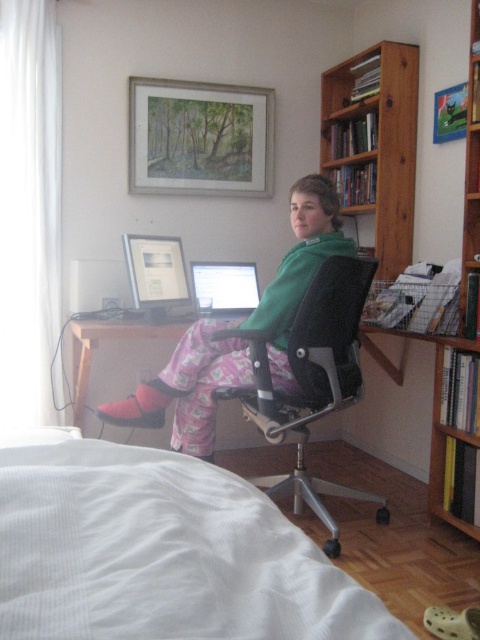
Question: Which point is closer to the camera taking this photo?

Choices:
 (A) (226, 100)
 (B) (404, 214)
 (C) (465, 90)

Answer: (C)

Question: Can you confirm if pink cotton pajamas at center is positioned to the left of metallic silver picture frame at upper right?

Choices:
 (A) no
 (B) yes

Answer: (B)

Question: Can you confirm if wooden desk at center is positioned below metallic silver picture frame at upper right?

Choices:
 (A) no
 (B) yes

Answer: (B)

Question: Does pink cotton pajamas at center appear over wooden bookshelf at upper right?

Choices:
 (A) no
 (B) yes

Answer: (A)

Question: Which is farther from the pink cotton pajamas at center?

Choices:
 (A) metallic silver picture frame at upper right
 (B) white textured bed at lower left
 (C) wooden desk at center
 (D) wooden bookshelf at right

Answer: (B)

Question: Estimate the real-world distances between objects in this image. Which object is farther from the white textured bed at lower left?

Choices:
 (A) wooden bookshelf at right
 (B) metallic silver picture frame at upper right
 (C) wooden bookshelf at upper right

Answer: (C)